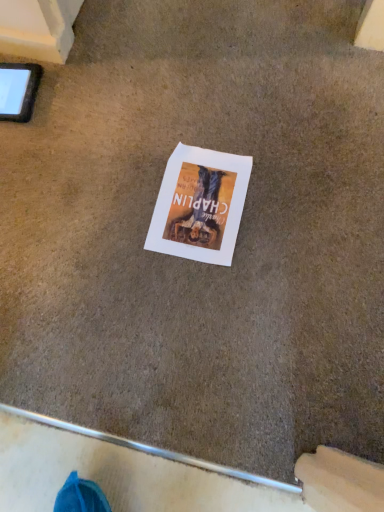
Question: Is point (31, 74) positioned closer to the camera than point (193, 218)?

Choices:
 (A) closer
 (B) farther

Answer: (B)

Question: Considering their positions, is black matte tablet at upper left located in front of or behind white paper at center?

Choices:
 (A) behind
 (B) front

Answer: (A)

Question: From the image's perspective, is black matte tablet at upper left located above or below white paper at center?

Choices:
 (A) below
 (B) above

Answer: (B)

Question: Does point (147, 241) appear closer or farther from the camera than point (14, 73)?

Choices:
 (A) farther
 (B) closer

Answer: (B)

Question: From a real-world perspective, relative to black matte tablet at upper left, is white paper at center vertically above or below?

Choices:
 (A) below
 (B) above

Answer: (A)

Question: From the image's perspective, is white paper at center located above or below black matte tablet at upper left?

Choices:
 (A) above
 (B) below

Answer: (B)

Question: In terms of size, does white paper at center appear bigger or smaller than black matte tablet at upper left?

Choices:
 (A) small
 (B) big

Answer: (A)